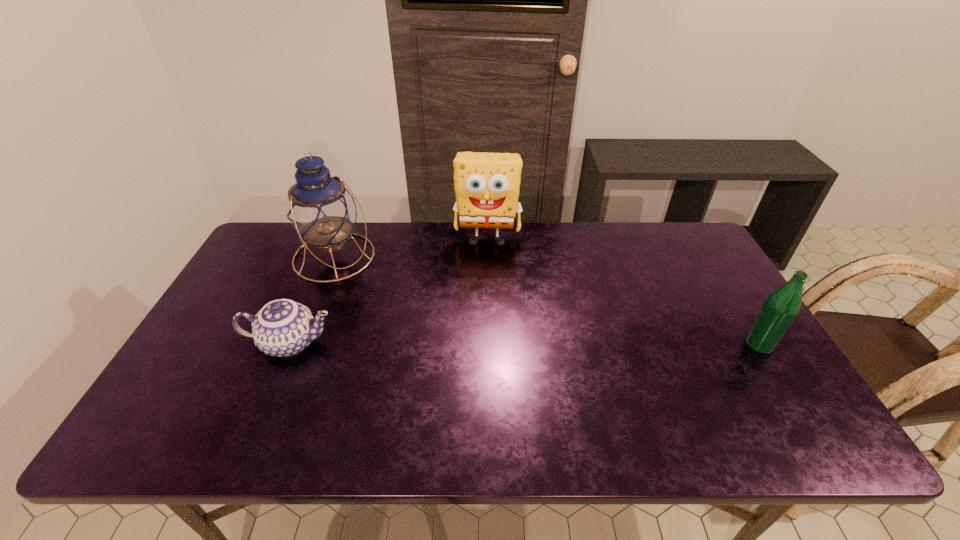
Locate an element on the screen. This screenshot has width=960, height=540. blank region between the third tallest object and the lantern is located at coordinates (547, 300).

What are the coordinates of `free point between the second tallest object and the bottle` in the screenshot? It's located at (623, 292).

Find the location of a particular element. The image size is (960, 540). vacant area that lies between the third object from left to right and the rightmost object is located at coordinates (623, 292).

The width and height of the screenshot is (960, 540). Find the location of `unoccupied position between the lantern and the third tallest object`. unoccupied position between the lantern and the third tallest object is located at coordinates (547, 300).

Locate an element on the screen. Image resolution: width=960 pixels, height=540 pixels. vacant space that's between the lantern and the bottle is located at coordinates (547, 300).

Where is `unoccupied area between the shortest object and the bottle`? The image size is (960, 540). unoccupied area between the shortest object and the bottle is located at coordinates (525, 343).

Identify which object is the third nearest to the bottle. Please provide its 2D coordinates. Your answer should be formatted as a tuple, i.e. [(x, y)], where the tuple contains the x and y coordinates of a point satisfying the conditions above.

[(283, 327)]

Locate an element on the screen. The width and height of the screenshot is (960, 540). object identified as the second closest to the tallest object is located at coordinates (487, 185).

At what (x,y) coordinates should I click in order to perform the action: click on vacant space that satisfies the following two spatial constraints: 1. on the front side of the second shortest object; 2. on the left side of the tallest object. Please return your answer as a coordinate pair (x, y). Looking at the image, I should click on (300, 344).